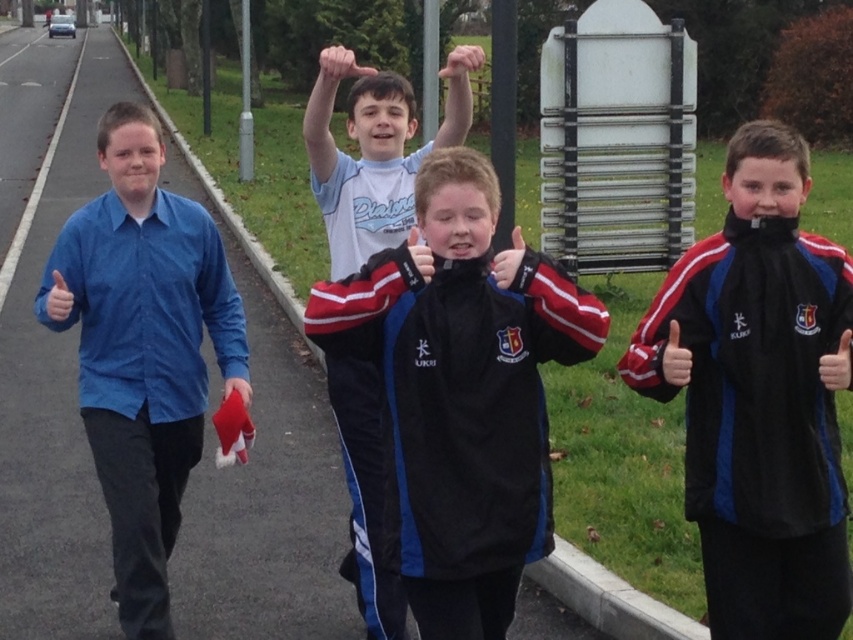
Question: Is velvet black jacket at center further to camera compared to blue cotton shirt at left?

Choices:
 (A) no
 (B) yes

Answer: (A)

Question: Is blue cotton shirt at left behind smooth skin hand at upper center?

Choices:
 (A) no
 (B) yes

Answer: (B)

Question: Which point is farther to the camera?

Choices:
 (A) smooth skin hand at upper center
 (B) blue cotton shirt at left
 (C) matte black hand at upper center
 (D) black velour jacket at right

Answer: (B)

Question: Can you confirm if blue cotton shirt at left is wider than smooth skin hand at upper center?

Choices:
 (A) no
 (B) yes

Answer: (A)

Question: Among these objects, which one is farthest from the camera?

Choices:
 (A) matte black hand at upper center
 (B) black velour jacket at right
 (C) velvet black jacket at center

Answer: (A)

Question: Based on their relative distances, which object is nearer to the black velour jacket at right?

Choices:
 (A) velvet black jacket at center
 (B) matte black hand at upper center

Answer: (A)